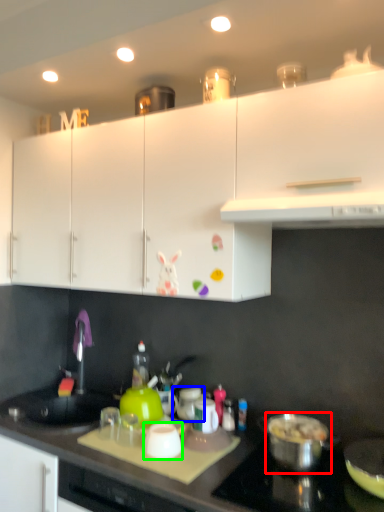
Question: Which object is the closest to the kitchen appliance (highlighted by a red box)? Choose among these: appliance (highlighted by a blue box) or kitchen appliance (highlighted by a green box).

Choices:
 (A) appliance
 (B) kitchen appliance

Answer: (A)